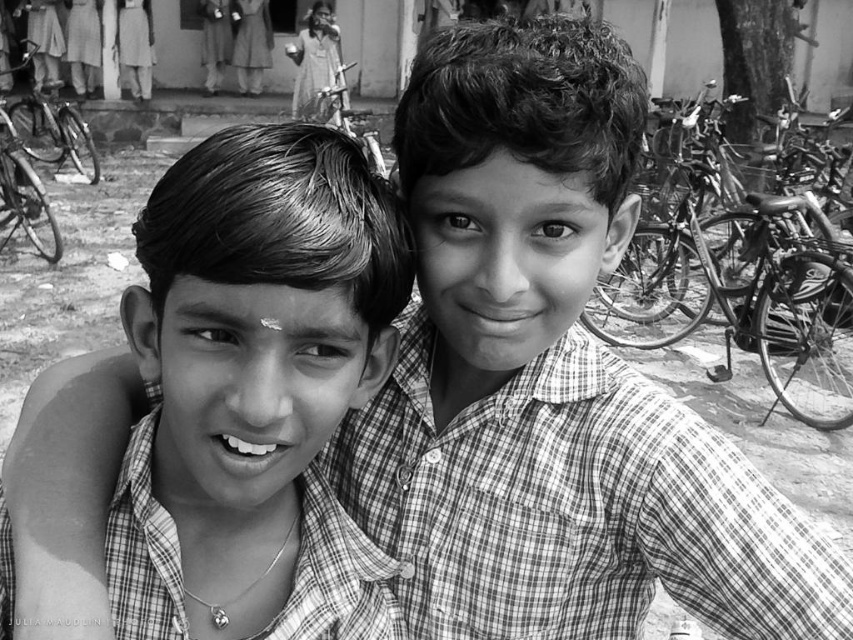
Question: Is checkered fabric shirt at center positioned in front of metallic silver bicycle at right?

Choices:
 (A) yes
 (B) no

Answer: (A)

Question: Which of the following is the closest to the observer?

Choices:
 (A) (317, 147)
 (B) (798, 256)

Answer: (A)

Question: Does checkered fabric shirt at center have a smaller size compared to metallic silver bicycle at right?

Choices:
 (A) yes
 (B) no

Answer: (A)

Question: Does checkered fabric shirt at center have a smaller size compared to metallic silver bicycle at right?

Choices:
 (A) no
 (B) yes

Answer: (B)